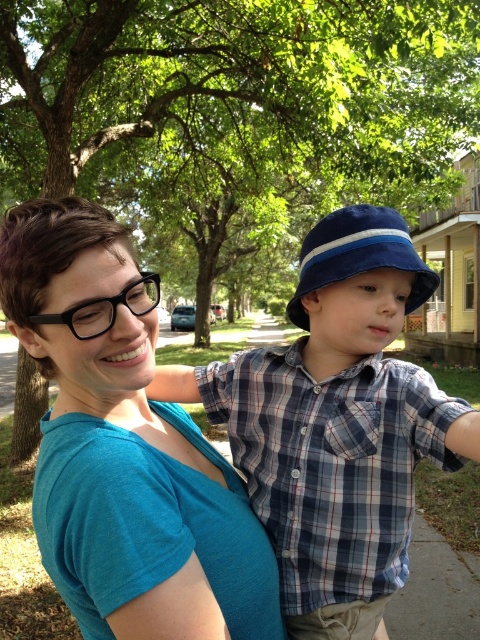
Does teal matte shirt at center have a larger size compared to blue fabric hat at center?

Yes.

Identify the location of teal matte shirt at center. (124, 448).

Where is `teal matte shirt at center`? teal matte shirt at center is located at coordinates 124,448.

Is teal matte shirt at center below blue plaid shirt at center?

Indeed, teal matte shirt at center is positioned under blue plaid shirt at center.

Is teal matte shirt at center to the left of blue plaid shirt at center from the viewer's perspective?

Correct, you'll find teal matte shirt at center to the left of blue plaid shirt at center.

Identify the location of teal matte shirt at center. This screenshot has height=640, width=480. (124, 448).

Locate an element on the screen. The image size is (480, 640). teal matte shirt at center is located at coordinates (124, 448).

Does blue plaid shirt at center lie in front of blue fabric hat at center?

Yes, blue plaid shirt at center is closer to the viewer.

Is blue plaid shirt at center below blue fabric hat at center?

Yes, blue plaid shirt at center is below blue fabric hat at center.

The width and height of the screenshot is (480, 640). What do you see at coordinates (336, 424) in the screenshot?
I see `blue plaid shirt at center` at bounding box center [336, 424].

Where is `blue plaid shirt at center`? The width and height of the screenshot is (480, 640). blue plaid shirt at center is located at coordinates (336, 424).